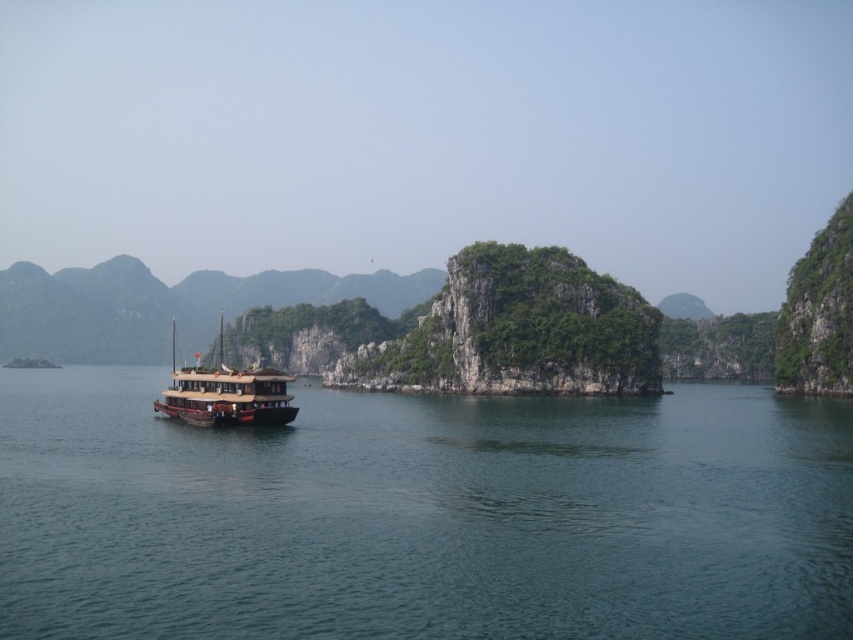
Is green water at lower left closer to the viewer compared to wooden boat at center?

Yes, green water at lower left is in front of wooden boat at center.

Between green water at lower left and wooden boat at center, which one appears on the right side from the viewer's perspective?

green water at lower left

Is point (637, 550) closer to camera compared to point (171, 326)?

Yes, it is.

At what (x,y) coordinates should I click in order to perform the action: click on green water at lower left. Please return your answer as a coordinate pair (x, y). This screenshot has height=640, width=853. Looking at the image, I should click on (422, 515).